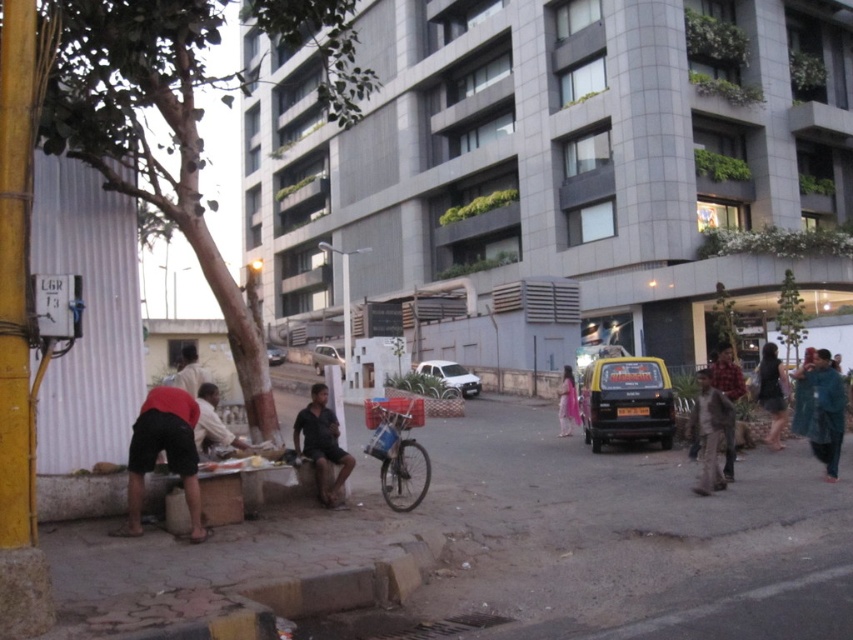
You are a delivery person who needs to park your metallic silver bicycle at center near the multi story building with gray concrete walls and numerous windows. Is the bicycle positioned close enough to the building to be secure?

The metallic silver bicycle at center is located at point (395,445), which is near the multi story building with gray concrete walls and numerous windows, so it is positioned close enough to the building to be secure.

You are a delivery drone with a wingspan of 1.2 meters. You need to fly from the green bark tree at left to the pink fabric dress at center. Can you safely navigate the space between them without any obstacles?

The distance between the green bark tree at left and the pink fabric dress at center is 37.93 meters. Since the drone has a wingspan of 1.2 meters, it can safely navigate the space as there are no obstacles mentioned in the scene description.

You are a delivery person who needs to park your metallic silver bicycle at center near the blue fabric at right. Can you park it there without the bicycle touching the blue fabric?

The metallic silver bicycle at center is below the blue fabric at right, so there is vertical space between them. However, since the question is about horizontal positioning, the description does not provide information about horizontal distance. Therefore, it is uncertain whether the bicycle can be parked there without touching the blue fabric.